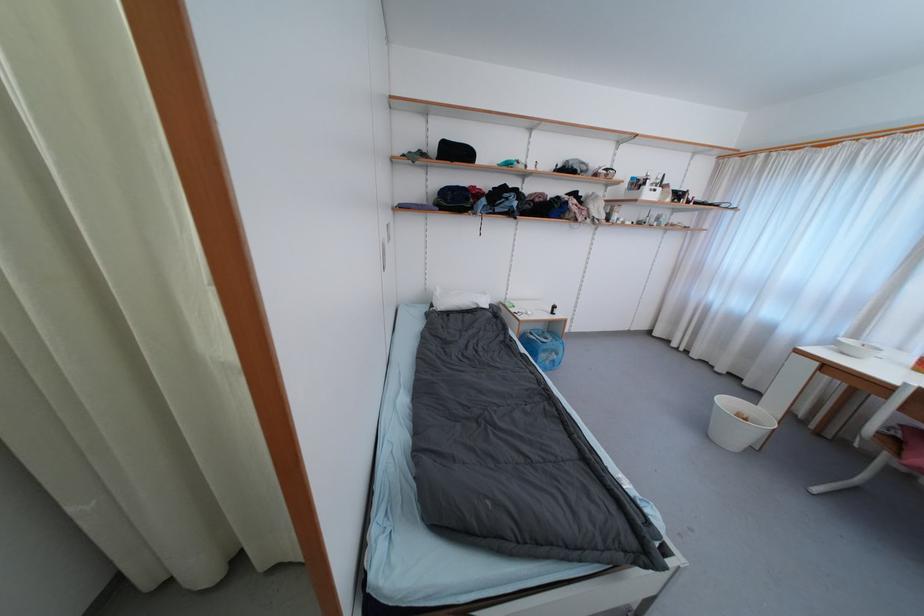
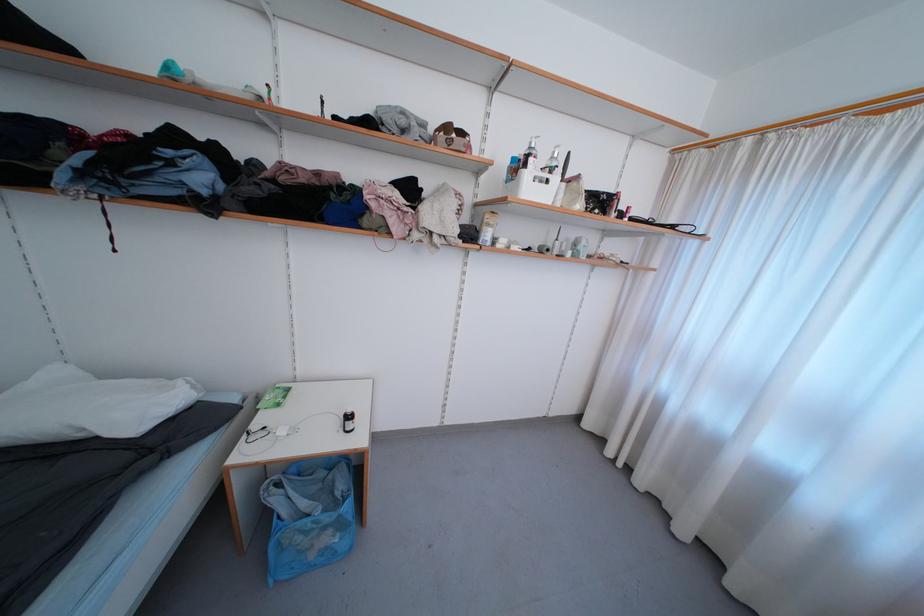
Locate, in the second image, the point that corresponds to pixel 535 336 in the first image.

(284, 488)